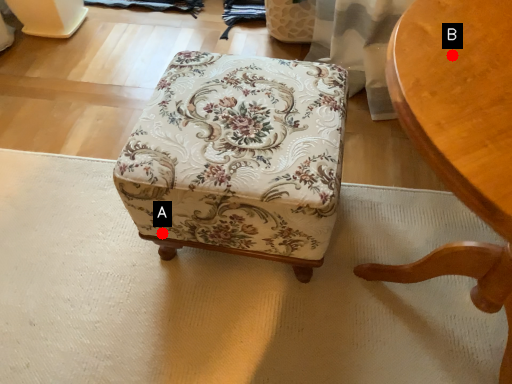
Question: Two points are circled on the image, labeled by A and B beside each circle. Which point is farther from the camera taking this photo?

Choices:
 (A) A is further
 (B) B is further

Answer: (A)